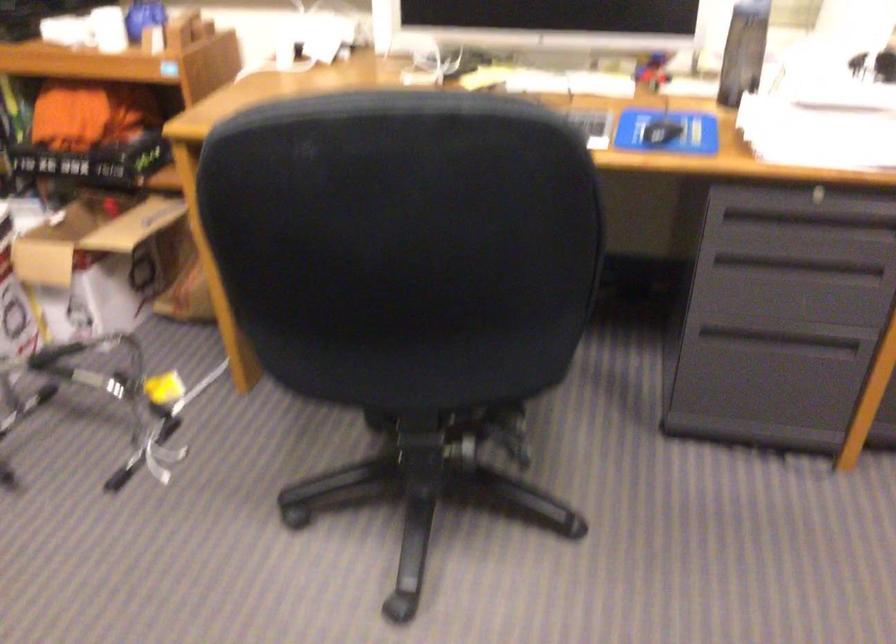
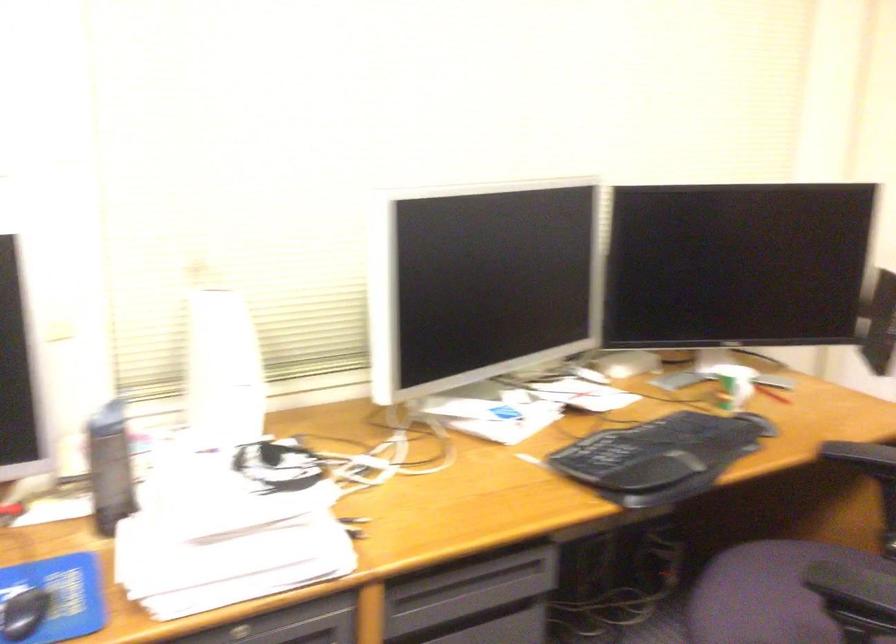
Question: The images are taken continuously from a first-person perspective. In which direction is your viewpoint rotating?

Choices:
 (A) Left
 (B) Right
 (C) Up
 (D) Down

Answer: (B)